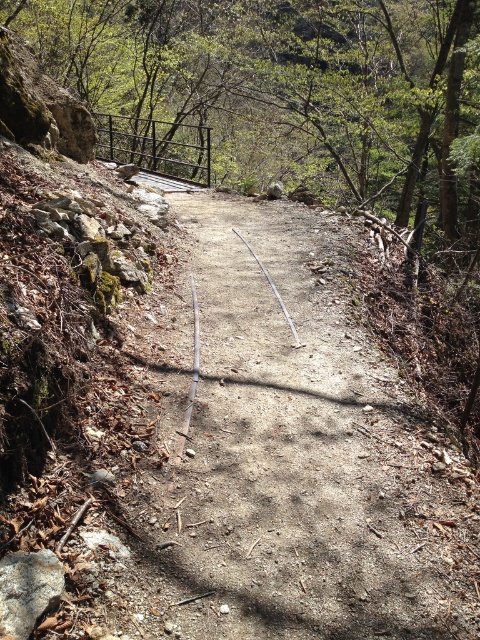
You are a hiker carrying a heavy backpack and need to step onto the dirt path at center from the gray rough rock at lower left. Considering their heights, which surface will require you to lift your foot higher?

The dirt path at center requires lifting your foot higher because it has a greater height compared to the gray rough rock at lower left.